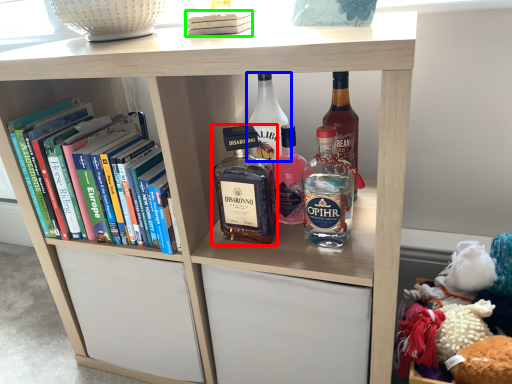
Question: Which object is positioned closest to bottle (highlighted by a red box)? Select from bottle (highlighted by a blue box) and book (highlighted by a green box).

Choices:
 (A) bottle
 (B) book

Answer: (A)